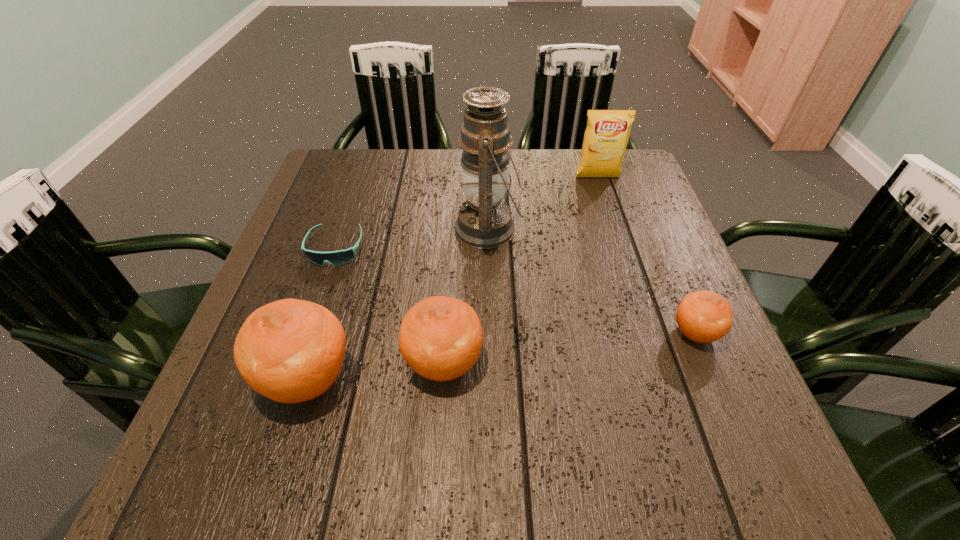
Locate an element on the screen. the leftmost orange is located at coordinates (290, 351).

Identify the location of the second shortest orange. This screenshot has width=960, height=540. (440, 338).

At what (x,y) coordinates should I click in order to perform the action: click on the second orange from left to right. Please return your answer as a coordinate pair (x, y). Looking at the image, I should click on (440, 338).

You are a GUI agent. You are given a task and a screenshot of the screen. Output one action in this format:
    pyautogui.click(x=<x>, y=<y>)
    Task: Click on the rightmost orange
    
    Given the screenshot: What is the action you would take?
    pyautogui.click(x=703, y=316)

At what (x,y) coordinates should I click in order to perform the action: click on the shortest orange. Please return your answer as a coordinate pair (x, y). The width and height of the screenshot is (960, 540). Looking at the image, I should click on [x=703, y=316].

The height and width of the screenshot is (540, 960). Find the location of `crisp (potato chip)`. crisp (potato chip) is located at coordinates (606, 136).

Where is `oil lamp`? oil lamp is located at coordinates (484, 221).

This screenshot has width=960, height=540. What are the coordinates of `sunglasses` in the screenshot? It's located at (340, 257).

Find the location of `vacant space located on the right of the leftmost orange`. vacant space located on the right of the leftmost orange is located at coordinates (515, 379).

Find the location of `vacant space situated on the back of the fourth tallest object`. vacant space situated on the back of the fourth tallest object is located at coordinates (451, 257).